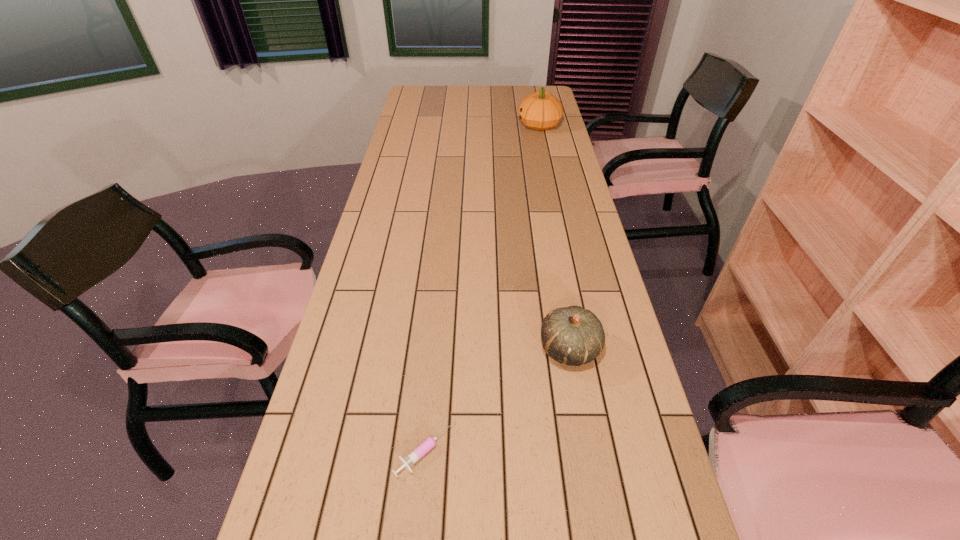
Identify the location of free space located 0.150m on the back of the syringe. (433, 365).

Identify the location of free spot at the far edge of the desktop. Image resolution: width=960 pixels, height=540 pixels. (516, 92).

Locate an element on the screen. vacant area at the left edge is located at coordinates (382, 210).

In the image, there is a desktop. Identify the location of vacant region at the right edge. (576, 222).

Find the location of a particular element. The height and width of the screenshot is (540, 960). vacant space at the far right corner of the desktop is located at coordinates (524, 89).

Where is `free space that is in between the taller gourd and the shortest object`? This screenshot has height=540, width=960. free space that is in between the taller gourd and the shortest object is located at coordinates (482, 288).

Where is `vacant region between the shorter gourd and the nearest object`? This screenshot has height=540, width=960. vacant region between the shorter gourd and the nearest object is located at coordinates (497, 399).

You are a GUI agent. You are given a task and a screenshot of the screen. Output one action in this format:
    pyautogui.click(x=<x>, y=<y>)
    Task: Click on the unoccupied area between the syringe and the shorter gourd
    
    Given the screenshot: What is the action you would take?
    pyautogui.click(x=497, y=399)

Locate an element on the screen. free point between the shorter gourd and the leftmost object is located at coordinates (497, 399).

At what (x,y) coordinates should I click in order to perform the action: click on vacant area that lies between the nearer gourd and the leftmost object. Please return your answer as a coordinate pair (x, y). The height and width of the screenshot is (540, 960). Looking at the image, I should click on (497, 399).